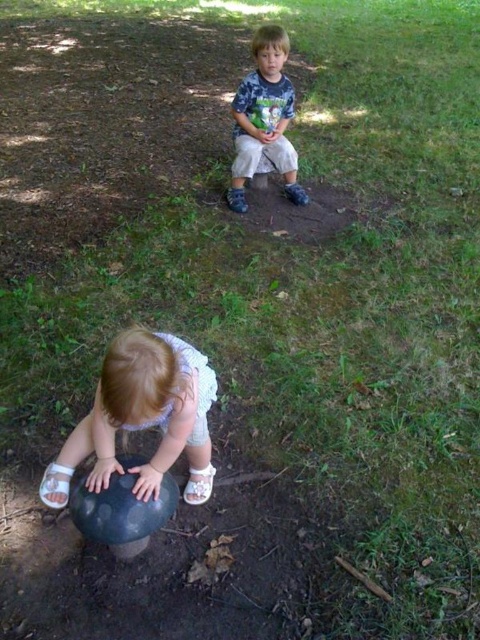
Question: Does smooth white sand at lower left have a larger size compared to matte blue shirt at upper center?

Choices:
 (A) no
 (B) yes

Answer: (B)

Question: Among these objects, which one is nearest to the camera?

Choices:
 (A) matte blue shirt at upper center
 (B) smooth white sand at lower left

Answer: (B)

Question: Does smooth white sand at lower left appear under matte blue shirt at upper center?

Choices:
 (A) yes
 (B) no

Answer: (A)

Question: Can you confirm if smooth white sand at lower left is smaller than matte blue shirt at upper center?

Choices:
 (A) no
 (B) yes

Answer: (A)

Question: Which of the following is the closest to the observer?

Choices:
 (A) (156, 474)
 (B) (269, 68)

Answer: (A)

Question: Which point is farther to the camera?

Choices:
 (A) (190, 417)
 (B) (291, 186)

Answer: (B)